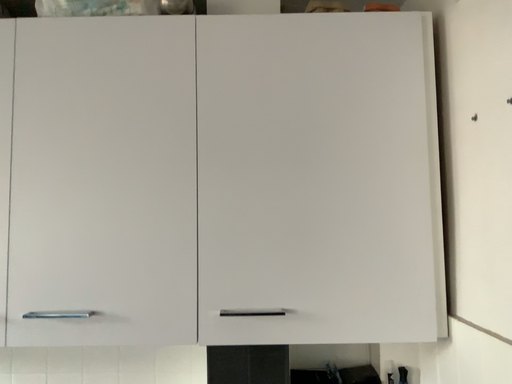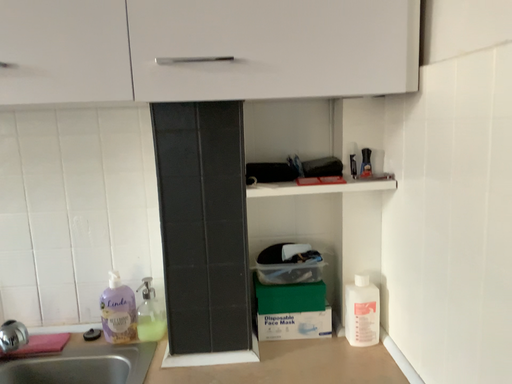
Question: How did the camera likely rotate when shooting the video?

Choices:
 (A) rotated upward
 (B) rotated downward

Answer: (B)